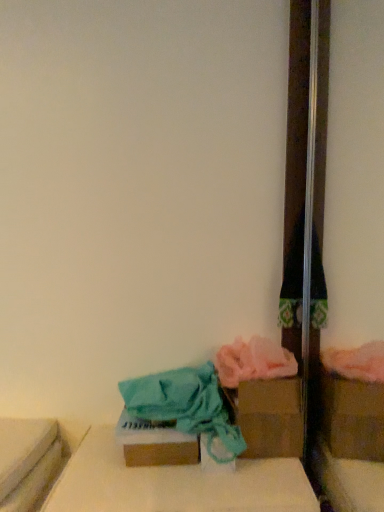
Locate an element on the screen. The image size is (384, 512). free location to the right of brown cardboard box at lower center, placed as the first storage box when sorted from front to back is located at coordinates (226, 489).